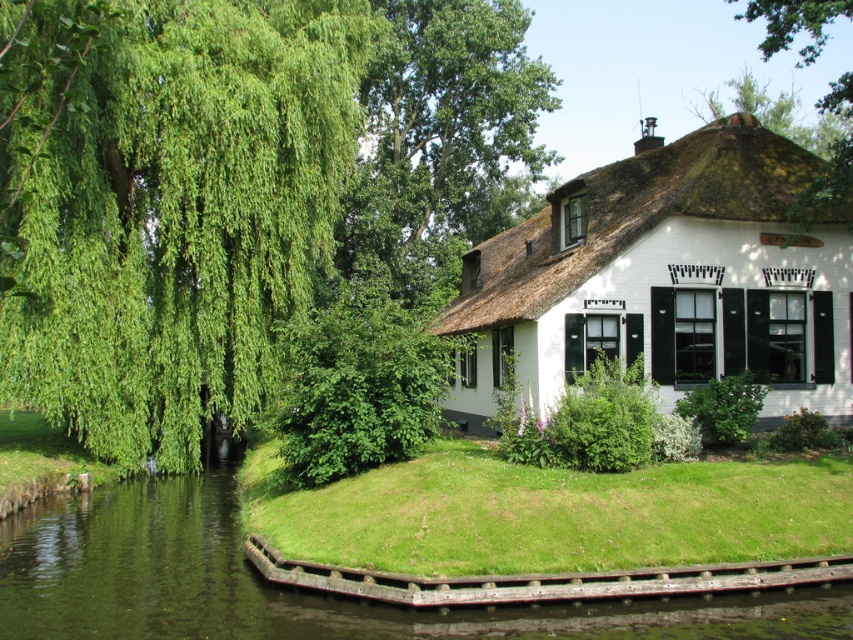
Can you confirm if green leafy willow at left is taller than green grassy river at lower left?

Correct, green leafy willow at left is much taller as green grassy river at lower left.

Is green leafy willow at left below green grassy river at lower left?

Actually, green leafy willow at left is above green grassy river at lower left.

Consider the image. Who is more distant from viewer, (50,72) or (242,616)?

The point (242,616) is behind.

You are a GUI agent. You are given a task and a screenshot of the screen. Output one action in this format:
    pyautogui.click(x=<x>, y=<y>)
    Task: Click on the green leafy willow at left
    Image resolution: width=853 pixels, height=640 pixels.
    Given the screenshot: What is the action you would take?
    pyautogui.click(x=166, y=205)

From the picture: Who is more forward, [132,612] or [474,186]?

Point [132,612] is more forward.

Does green grassy river at lower left appear on the right side of green leafy tree at upper center?

Incorrect, green grassy river at lower left is not on the right side of green leafy tree at upper center.

Between point (834, 612) and point (372, 227), which one is positioned behind?

Point (372, 227)

Locate an element on the screen. green grassy river at lower left is located at coordinates (294, 589).

Is point (502, 321) behind point (56, 636)?

Yes, it is.

Does white thatched roof cottage at center have a lesser width compared to green grassy river at lower left?

Indeed, white thatched roof cottage at center has a lesser width compared to green grassy river at lower left.

Who is more distant from viewer, (483, 371) or (202, 504)?

Positioned behind is point (483, 371).

Identify the location of white thatched roof cottage at center. The height and width of the screenshot is (640, 853). (666, 280).